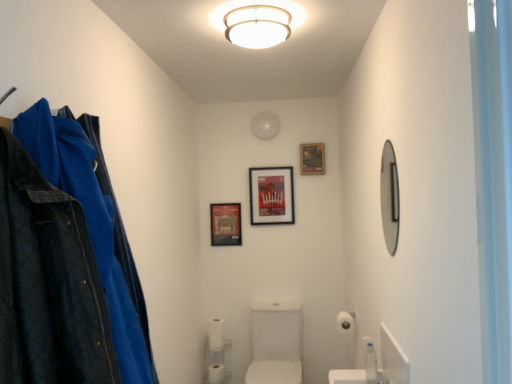
Question: Is white glossy sink at center closer to camera compared to white matte toilet paper at lower center, which is counted as the 2th toilet paper, starting from the top?

Choices:
 (A) yes
 (B) no

Answer: (A)

Question: Is white glossy sink at center next to white matte toilet paper at lower center, which is the second toilet paper from bottom to top?

Choices:
 (A) no
 (B) yes

Answer: (A)

Question: Is white glossy sink at center behind white matte toilet paper at lower center, which is the 2th toilet paper in left-to-right order?

Choices:
 (A) yes
 (B) no

Answer: (B)

Question: From the image's perspective, is white glossy sink at center beneath white matte toilet paper at lower center, which is counted as the 2th toilet paper, starting from the top?

Choices:
 (A) no
 (B) yes

Answer: (B)

Question: Is white glossy sink at center shorter than white matte toilet paper at lower center, which ranks as the third toilet paper in front-to-back order?

Choices:
 (A) yes
 (B) no

Answer: (B)

Question: From the image's perspective, is clear plastic bottle at lower right located above or below white plastic shelf at lower center?

Choices:
 (A) below
 (B) above

Answer: (B)

Question: Does point [x=370, y=362] appear closer or farther from the camera than point [x=212, y=380]?

Choices:
 (A) closer
 (B) farther

Answer: (A)

Question: Considering the positions of clear plastic bottle at lower right and white plastic shelf at lower center in the image, is clear plastic bottle at lower right wider or thinner than white plastic shelf at lower center?

Choices:
 (A) wide
 (B) thin

Answer: (B)

Question: Looking at the image, does clear plastic bottle at lower right seem bigger or smaller compared to white plastic shelf at lower center?

Choices:
 (A) small
 (B) big

Answer: (A)

Question: Is point (254, 41) positioned closer to the camera than point (322, 142)?

Choices:
 (A) farther
 (B) closer

Answer: (B)

Question: Considering the positions of white matte ceiling light at upper center and matte black picture frame at upper center, arranged as the 1th picture frame when viewed from the right, in the image, is white matte ceiling light at upper center bigger or smaller than matte black picture frame at upper center, arranged as the 1th picture frame when viewed from the right,?

Choices:
 (A) big
 (B) small

Answer: (A)

Question: In the image, is white matte ceiling light at upper center on the left side or the right side of matte black picture frame at upper center, placed as the third picture frame when sorted from left to right?

Choices:
 (A) right
 (B) left

Answer: (B)

Question: Is white matte ceiling light at upper center spatially inside matte black picture frame at upper center, arranged as the 1th picture frame when viewed from the right, or outside of it?

Choices:
 (A) inside
 (B) outside

Answer: (B)

Question: Considering the positions of point tap(284, 331) and point tap(207, 339), is point tap(284, 331) closer or farther from the camera than point tap(207, 339)?

Choices:
 (A) farther
 (B) closer

Answer: (B)

Question: Based on their sizes in the image, would you say white glossy sink at center is bigger or smaller than white plastic shelf at lower center?

Choices:
 (A) big
 (B) small

Answer: (A)